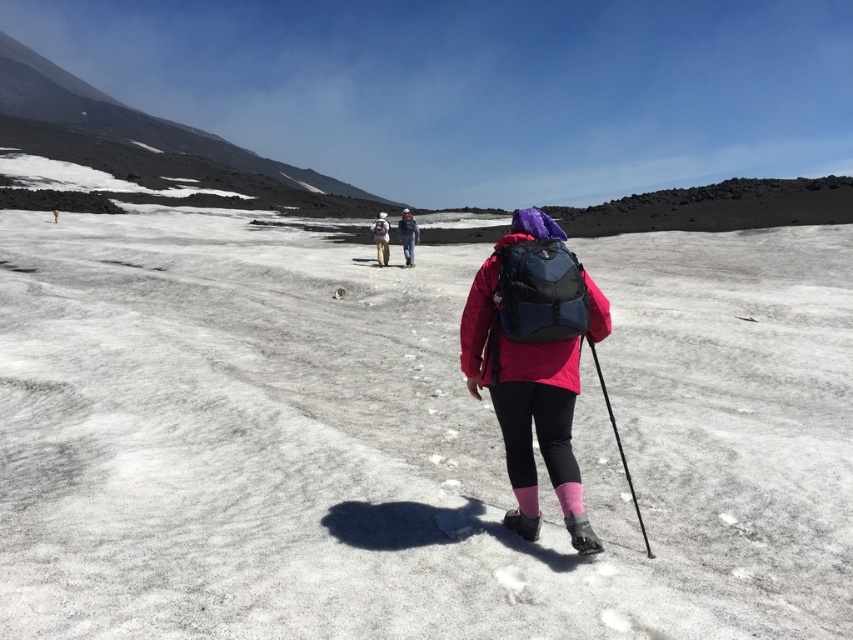
Question: Is black plastic ski pole at center to the left of matte gray jacket at center from the viewer's perspective?

Choices:
 (A) yes
 (B) no

Answer: (B)

Question: Which object is the farthest from the white snow at center?

Choices:
 (A) matte gray helmet at center
 (B) matte gray jacket at center
 (C) matte black backpack at center

Answer: (B)

Question: Can you confirm if white snow at center is smaller than matte gray jacket at center?

Choices:
 (A) no
 (B) yes

Answer: (A)

Question: Based on their relative distances, which object is nearer to the matte black backpack at center?

Choices:
 (A) white snow at center
 (B) matte gray jacket at center

Answer: (A)

Question: Is black plastic ski pole at center below matte gray jacket at center?

Choices:
 (A) no
 (B) yes

Answer: (B)

Question: Which of the following is the closest to the observer?

Choices:
 (A) (412, 262)
 (B) (598, 369)

Answer: (B)